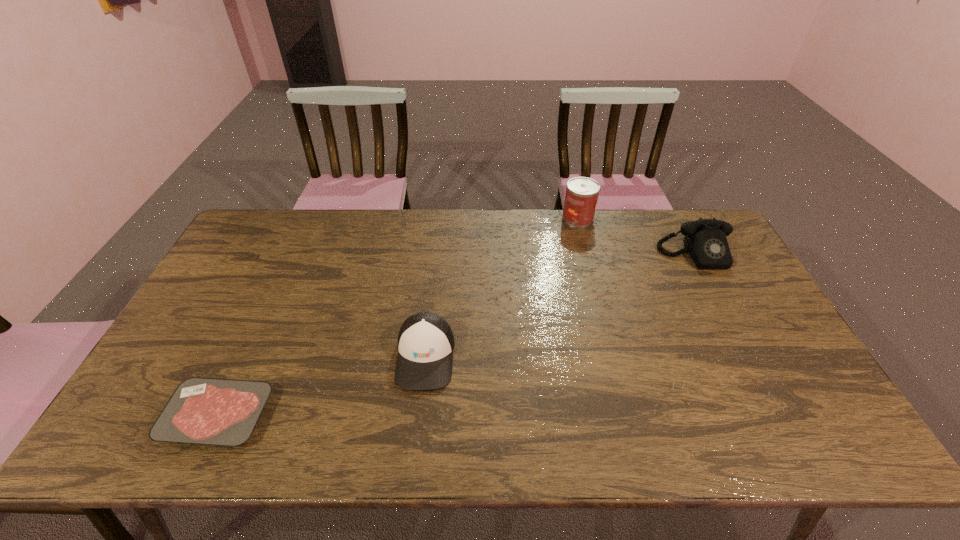
In the image, there is a desktop. At what (x,y) coordinates should I click in order to perform the action: click on free region at the near left corner. Please return your answer as a coordinate pair (x, y). The width and height of the screenshot is (960, 540). Looking at the image, I should click on (132, 416).

Locate an element on the screen. free space at the far right corner of the desktop is located at coordinates (706, 213).

Find the location of a particular element. This screenshot has width=960, height=540. unoccupied position between the steak and the cap is located at coordinates (322, 386).

Locate an element on the screen. The width and height of the screenshot is (960, 540). free area in between the tallest object and the telephone is located at coordinates (636, 237).

You are a GUI agent. You are given a task and a screenshot of the screen. Output one action in this format:
    pyautogui.click(x=<x>, y=<y>)
    Task: Click on the free space between the second object from left to right and the telephone
    Image resolution: width=960 pixels, height=540 pixels.
    Given the screenshot: What is the action you would take?
    pyautogui.click(x=560, y=306)

Find the location of `vacant area that lies between the cap and the leftmost object`. vacant area that lies between the cap and the leftmost object is located at coordinates (322, 386).

The width and height of the screenshot is (960, 540). What are the coordinates of `empty space between the cap and the third object from left to right` in the screenshot? It's located at (501, 287).

Identify the location of vacant space in between the steak and the third object from left to right. (397, 317).

Find the location of a particular element. The height and width of the screenshot is (540, 960). empty space between the steak and the telephone is located at coordinates (456, 336).

Image resolution: width=960 pixels, height=540 pixels. Identify the location of vacant area between the farthest object and the second farthest object. (636, 237).